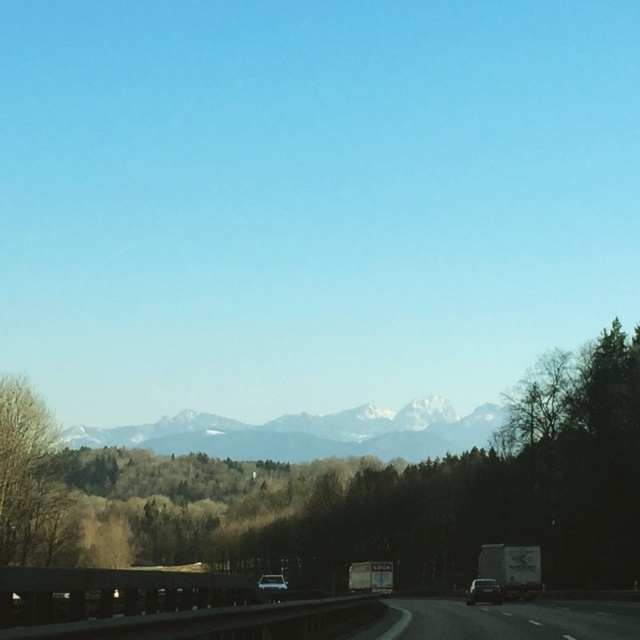
Question: Does shiny black car at center appear on the left side of metallic silver car at center?

Choices:
 (A) yes
 (B) no

Answer: (B)

Question: Which of these objects is positioned closest to the snowy granite mountain range at center?

Choices:
 (A) metallic silver car at center
 (B) shiny black car at center
 (C) bare branches at left

Answer: (C)

Question: Which point is farther to the camera?

Choices:
 (A) (472, 602)
 (B) (280, 579)

Answer: (B)

Question: Can you confirm if bare branches at left is bigger than metallic silver car at center?

Choices:
 (A) yes
 (B) no

Answer: (B)

Question: Can you confirm if shiny black car at center is smaller than metallic silver car at center?

Choices:
 (A) yes
 (B) no

Answer: (A)

Question: Which point is closer to the camera?

Choices:
 (A) shiny black car at center
 (B) snowy granite mountain range at center
 (C) bare branches at left

Answer: (A)